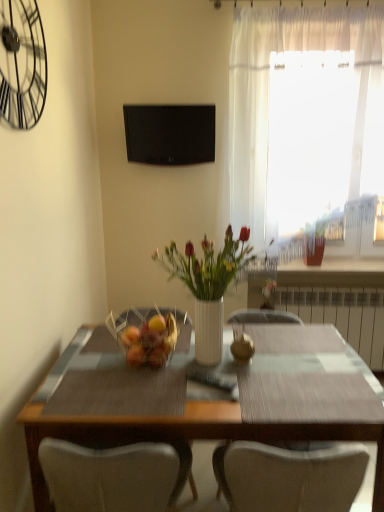
Question: Is black matte television at upper center inside translucent fabric curtain at upper right?

Choices:
 (A) no
 (B) yes

Answer: (A)

Question: Considering the relative sizes of translucent fabric curtain at upper right and black matte television at upper center in the image provided, is translucent fabric curtain at upper right wider than black matte television at upper center?

Choices:
 (A) no
 (B) yes

Answer: (B)

Question: From a real-world perspective, is translucent fabric curtain at upper right below black matte television at upper center?

Choices:
 (A) yes
 (B) no

Answer: (A)

Question: Is translucent fabric curtain at upper right next to black matte television at upper center?

Choices:
 (A) no
 (B) yes

Answer: (A)

Question: Is translucent fabric curtain at upper right located outside black matte television at upper center?

Choices:
 (A) no
 (B) yes

Answer: (B)

Question: Is translucent fabric curtain at upper right to the right of black matte television at upper center from the viewer's perspective?

Choices:
 (A) no
 (B) yes

Answer: (B)

Question: Is white metallic radiator at right directly adjacent to white glossy vase at center?

Choices:
 (A) no
 (B) yes

Answer: (A)

Question: Considering the relative sizes of white metallic radiator at right and white glossy vase at center in the image provided, is white metallic radiator at right bigger than white glossy vase at center?

Choices:
 (A) yes
 (B) no

Answer: (A)

Question: Is white metallic radiator at right positioned behind white glossy vase at center?

Choices:
 (A) no
 (B) yes

Answer: (B)

Question: Are white metallic radiator at right and white glossy vase at center far apart?

Choices:
 (A) yes
 (B) no

Answer: (A)

Question: Is white metallic radiator at right outside white glossy vase at center?

Choices:
 (A) yes
 (B) no

Answer: (A)

Question: From the image's perspective, would you say white metallic radiator at right is positioned over white glossy vase at center?

Choices:
 (A) yes
 (B) no

Answer: (B)

Question: From the image's perspective, is white glossy vase at center on black matte television at upper center?

Choices:
 (A) no
 (B) yes

Answer: (A)